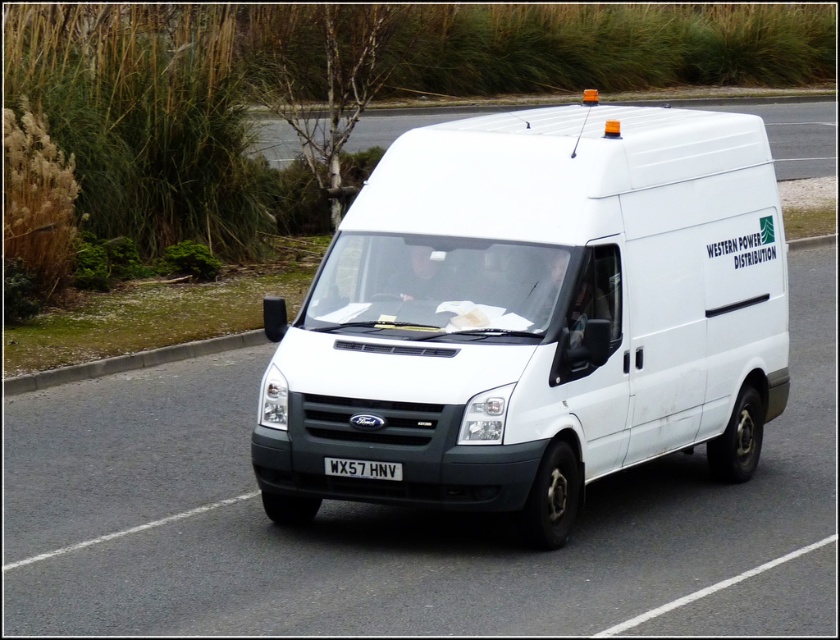
Question: Which point appears closest to the camera in this image?

Choices:
 (A) (483, 508)
 (B) (399, 472)

Answer: (B)

Question: Estimate the real-world distances between objects in this image. Which object is closer to the white matte van at center?

Choices:
 (A) white plastic van at center
 (B) black plastic license plate at center

Answer: (B)

Question: Which of the following is the closest to the observer?

Choices:
 (A) (701, 189)
 (B) (395, 116)
 (C) (365, 460)

Answer: (C)

Question: Is white matte van at center smaller than white plastic van at center?

Choices:
 (A) no
 (B) yes

Answer: (B)

Question: Is white matte van at center wider than black plastic license plate at center?

Choices:
 (A) yes
 (B) no

Answer: (A)

Question: Is white matte van at center in front of black plastic license plate at center?

Choices:
 (A) yes
 (B) no

Answer: (A)